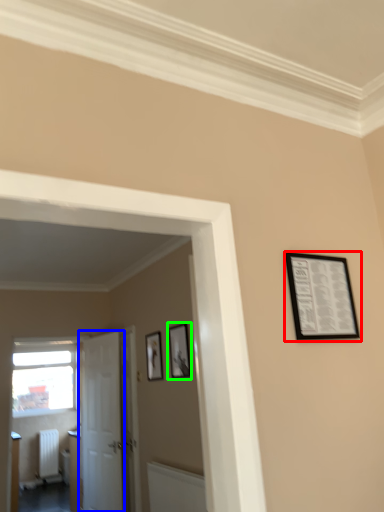
Question: Which object is the closest to the picture frame (highlighted by a red box)? Choose among these: door (highlighted by a blue box) or picture frame (highlighted by a green box).

Choices:
 (A) door
 (B) picture frame

Answer: (B)